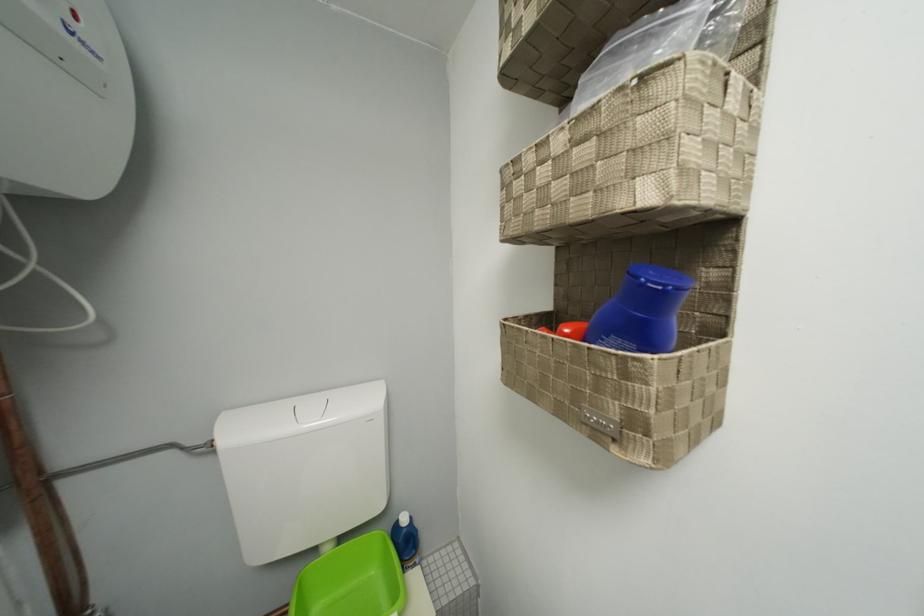
Describe the element at coordinates (660, 277) in the screenshot. The height and width of the screenshot is (616, 924). I see `the blue bottle cap` at that location.